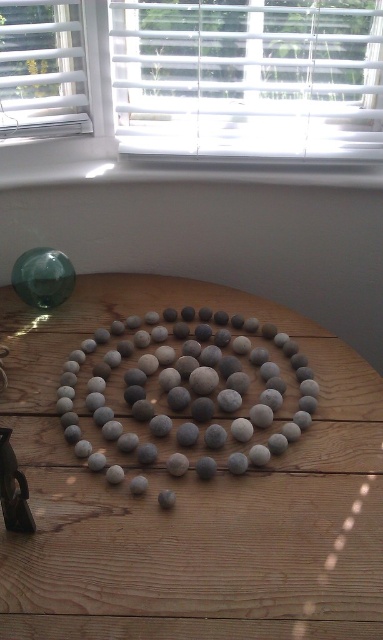
Between white plastic blinds at upper center and smooth gray pebbles at center, which one appears on the left side from the viewer's perspective?

smooth gray pebbles at center

Looking at this image, is white plastic blinds at upper center positioned before smooth gray pebbles at center?

That is False.

Is point (127, 74) behind point (144, 413)?

Yes, point (127, 74) is behind point (144, 413).

This screenshot has width=383, height=640. Identify the location of white plastic blinds at upper center. (248, 76).

Is wooden table at center taller than white plastic blinds at upper center?

Correct, wooden table at center is much taller as white plastic blinds at upper center.

Can you confirm if wooden table at center is positioned above white plastic blinds at upper center?

Incorrect, wooden table at center is not positioned above white plastic blinds at upper center.

Does point (91, 358) come in front of point (338, 20)?

Yes, point (91, 358) is in front of point (338, 20).

The width and height of the screenshot is (383, 640). I want to click on wooden table at center, so click(189, 493).

Can you confirm if wooden table at center is positioned to the left of white plastic window sill at upper center?

Yes, wooden table at center is to the left of white plastic window sill at upper center.

Which is more to the left, wooden table at center or white plastic window sill at upper center?

wooden table at center

Does point (124, 609) lie behind point (129, 179)?

No, (124, 609) is closer to viewer.

Where is `wooden table at center`? wooden table at center is located at coordinates (189, 493).